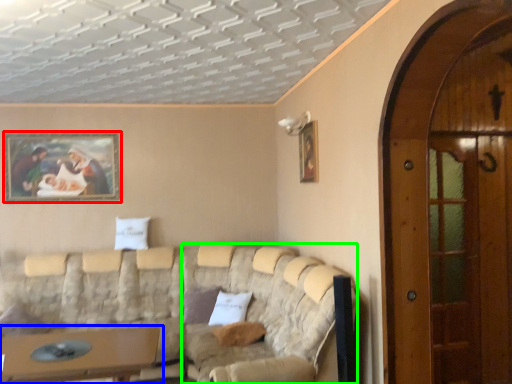
Question: Which is nearer to the picture frame (highlighted by a red box)? table (highlighted by a blue box) or couch (highlighted by a green box).

Choices:
 (A) table
 (B) couch

Answer: (B)